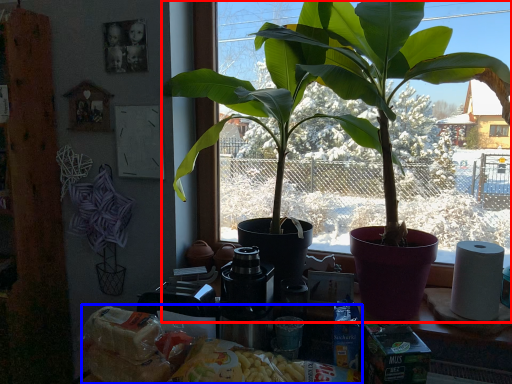
Question: Which point is closer to the camera, houseplant (highlighted by a red box) or food (highlighted by a blue box)?

Choices:
 (A) houseplant
 (B) food

Answer: (B)